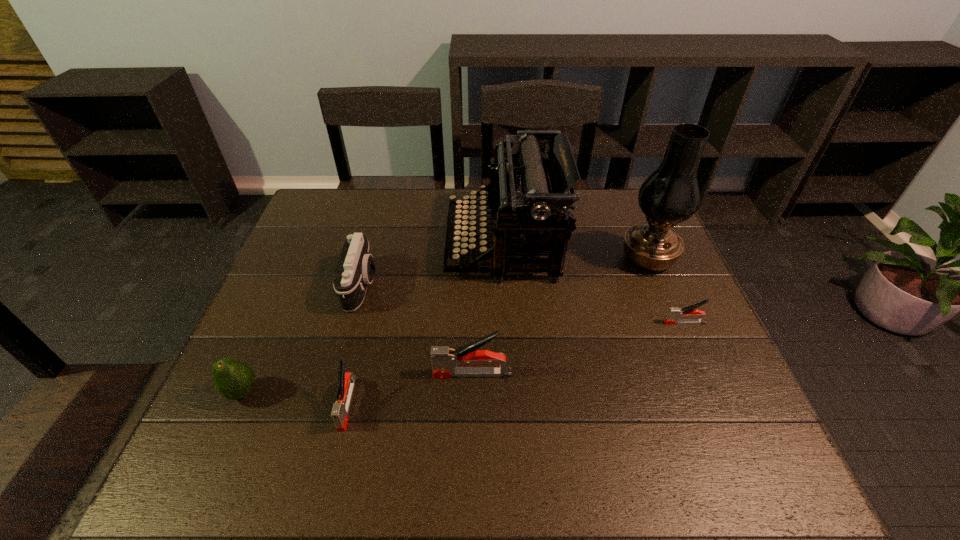
You are a GUI agent. You are given a task and a screenshot of the screen. Output one action in this format:
    pyautogui.click(x=<x>, y=<y>)
    Task: Click on the vacant space at the far left corner
    This screenshot has width=960, height=540.
    Given the screenshot: What is the action you would take?
    [x=351, y=206]

This screenshot has width=960, height=540. Find the location of `vacant space at the near left corner of the desktop`. vacant space at the near left corner of the desktop is located at coordinates (272, 397).

At what (x,y) coordinates should I click in order to perform the action: click on empty space between the second shortest stapler and the farthest stapler. Please return your answer as a coordinate pair (x, y). The image size is (960, 540). Looking at the image, I should click on (516, 363).

In order to click on free area in between the second shortest stapler and the sixth shortest object in this screenshot , I will do `click(425, 324)`.

Locate an element on the screen. The width and height of the screenshot is (960, 540). free point between the second tallest object and the tallest object is located at coordinates (575, 252).

Find the location of a particular element. empty space between the leftmost object and the second stapler from right to left is located at coordinates (358, 383).

The height and width of the screenshot is (540, 960). Identify the location of unoccupied position between the camera and the sixth shortest object. (432, 265).

I want to click on free space between the second stapler from right to left and the second tallest stapler, so click(410, 389).

Locate an element on the screen. Image resolution: width=960 pixels, height=540 pixels. free space between the second shortest stapler and the camera is located at coordinates (355, 345).

At what (x,y) coordinates should I click in order to perform the action: click on free area in between the tallest stapler and the shortest object. Please return your answer as a coordinate pair (x, y). The image size is (960, 540). Looking at the image, I should click on (579, 348).